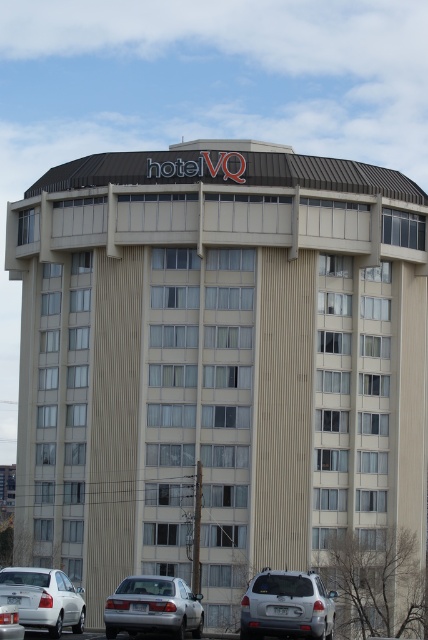
You are standing in front of Hotel VQ and want to park your car. The parking spot you want is located at point (287,605). What type of vehicle is currently parked there?

The point (287,605) corresponds to the silver metallic suv at lower center, so the silver metallic suv at lower center is parked there.

You are a valet parking attendant at Hotel VQ. You need to park a new car that is the same size as the silver metallic sedan at lower left. There is a parking spot next to the white matte sedan at lower left. Will the new car fit in that spot?

The silver metallic sedan at lower left is bigger than the white matte sedan at lower left. Therefore, the new car, which is the same size as the silver metallic sedan at lower left, may not fit in the parking spot next to the white matte sedan at lower left since the spot might be sized for the smaller vehicle.

You are standing at the entrance of Hotel VQ and want to take a photo of the point marked at coordinates point (243, 616). If your camera has a maximum focus range of 100 feet, will you be able to capture the point clearly?

The point (243, 616) is 113.50 feet away from the camera. Since the camera can only focus up to 100 feet, it will not be able to capture the point clearly.